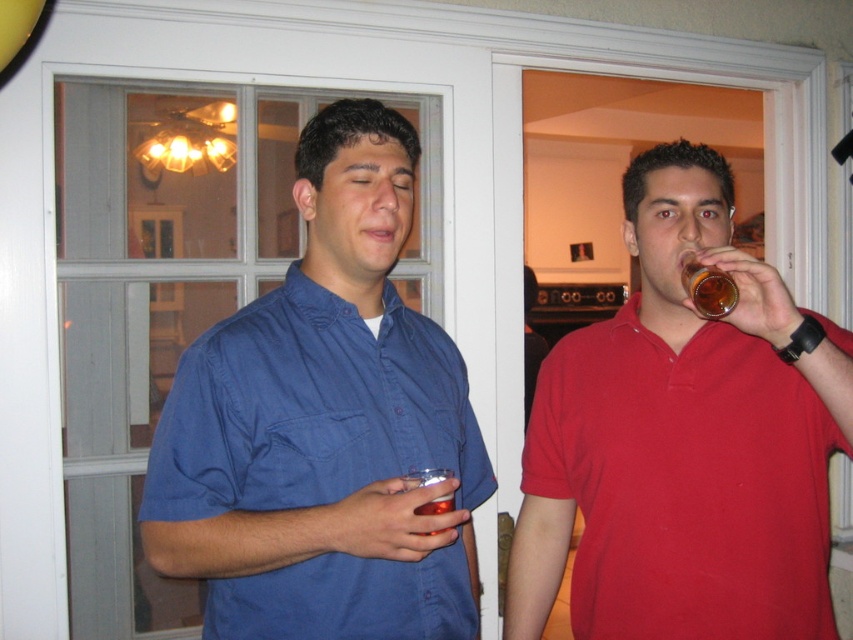
What is the location of the translucent amber glass at upper right in the image?

The translucent amber glass at upper right is located at point (706, 288).

In the scene shown: You are standing at the point marked by the coordinates point (685, 288) in the image. You want to move to the door in the background. Is the door in front of you or behind you?

The point (685, 288) is 3.86 feet away from the viewer, so the door is behind you.

You are standing in the room and want to move from point (718,269) to point (445,472). Is the path between these two points clear of any obstacles?

The path between point (718,269) and point (445,472) is clear of obstacles because the two points are positioned in the same plane, allowing for unobstructed movement.